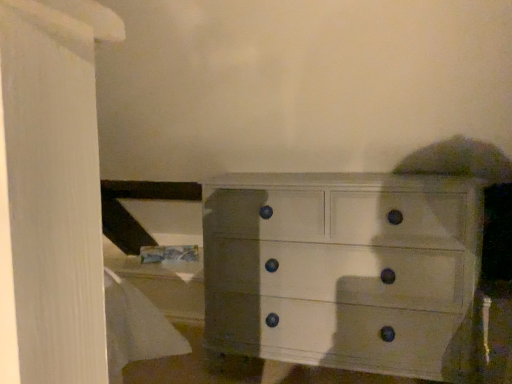
Question: Should I look upward or downward to see white painted wood chest of drawers at center?

Choices:
 (A) down
 (B) up

Answer: (A)